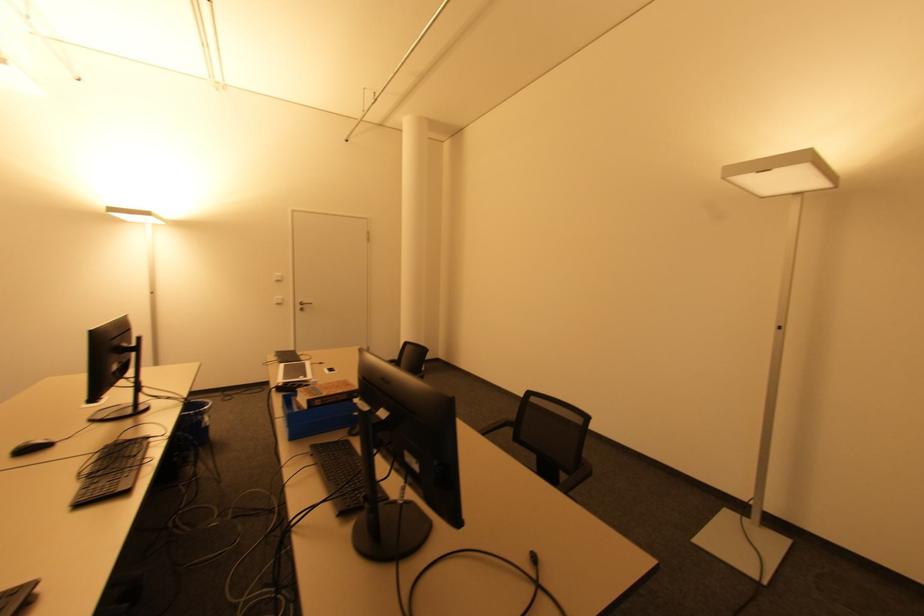
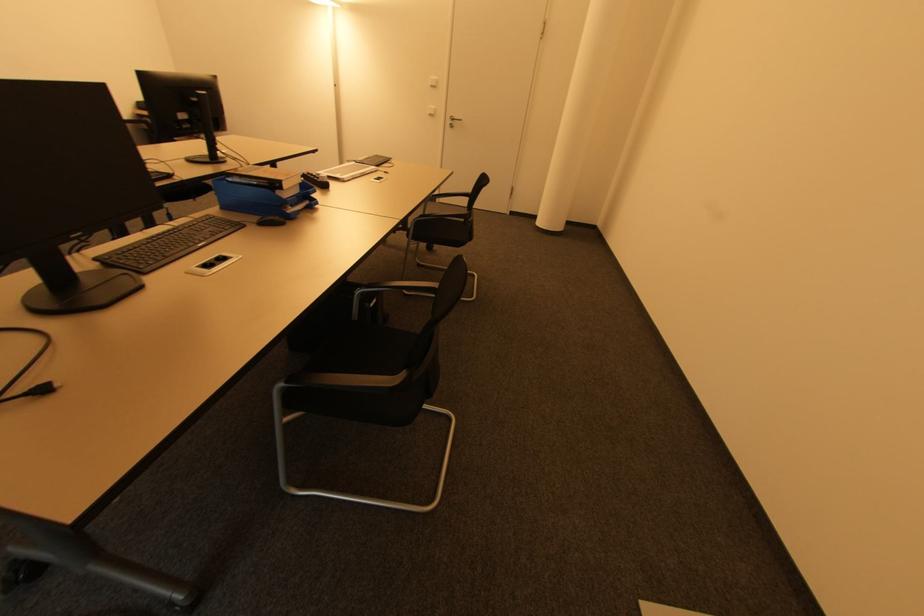
In the second image, find the point that corresponds to (304,310) in the first image.

(454, 127)